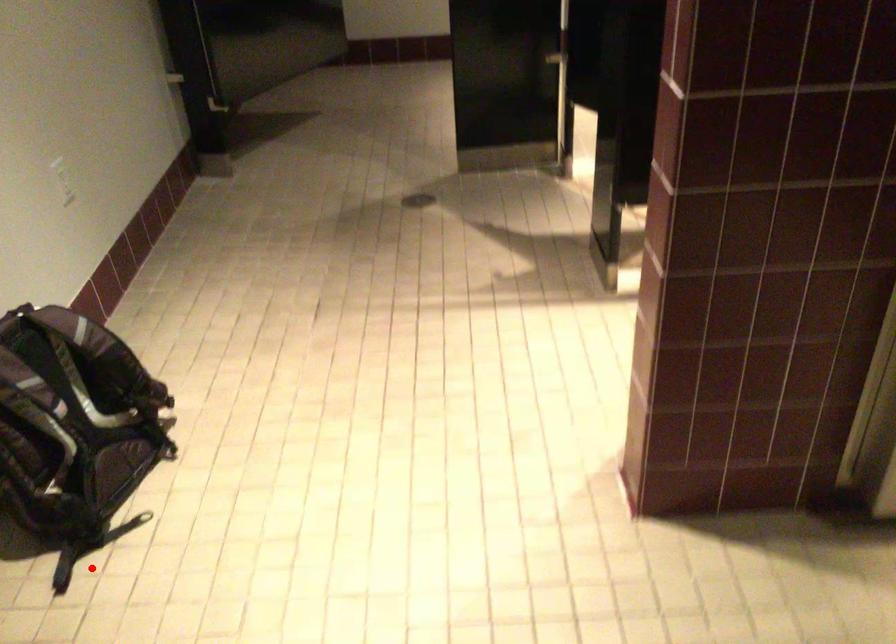
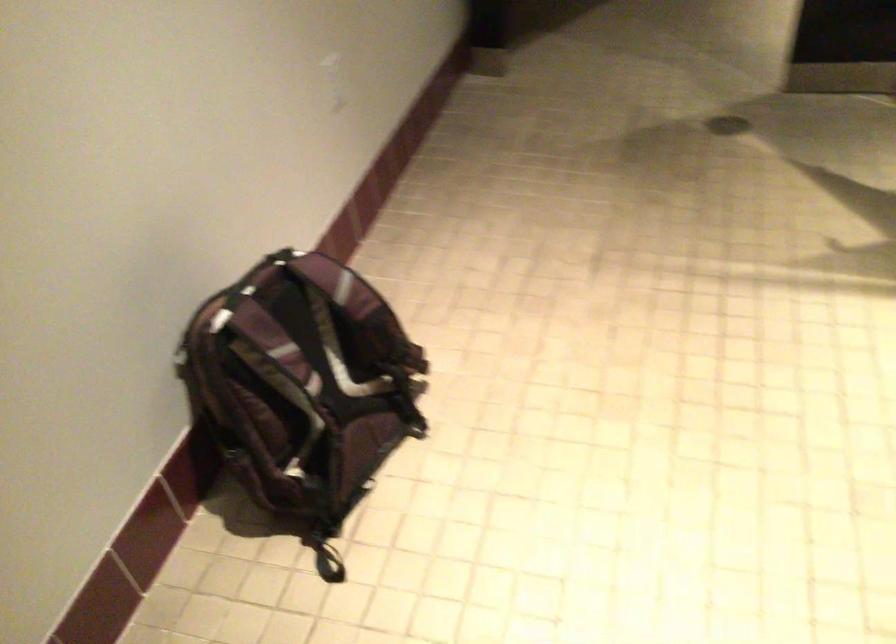
Question: A red point is marked in image1. In image2, is the corresponding 3D point closer to the camera or farther? Reply with the corresponding letter.

Choices:
 (A) The corresponding 3D point is closer.
 (B) The corresponding 3D point is farther.

Answer: (A)